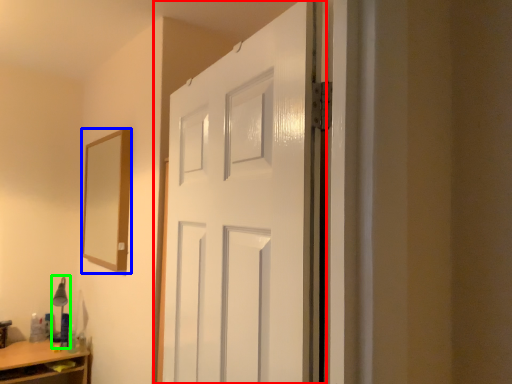
Question: Estimate the real-world distances between objects in this image. Which object is farther from door (highlighted by a red box), mirror (highlighted by a blue box) or table lamp (highlighted by a green box)?

Choices:
 (A) mirror
 (B) table lamp

Answer: (B)